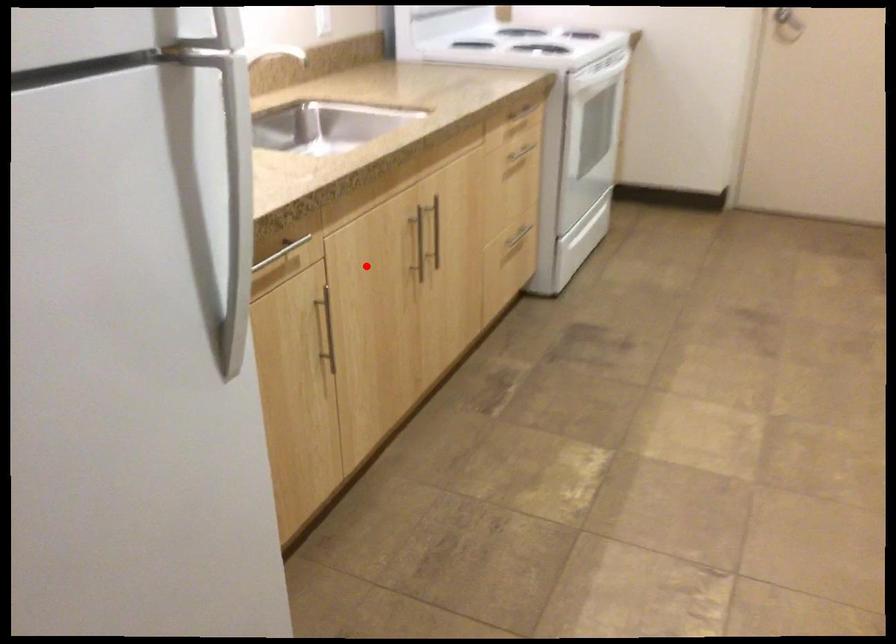
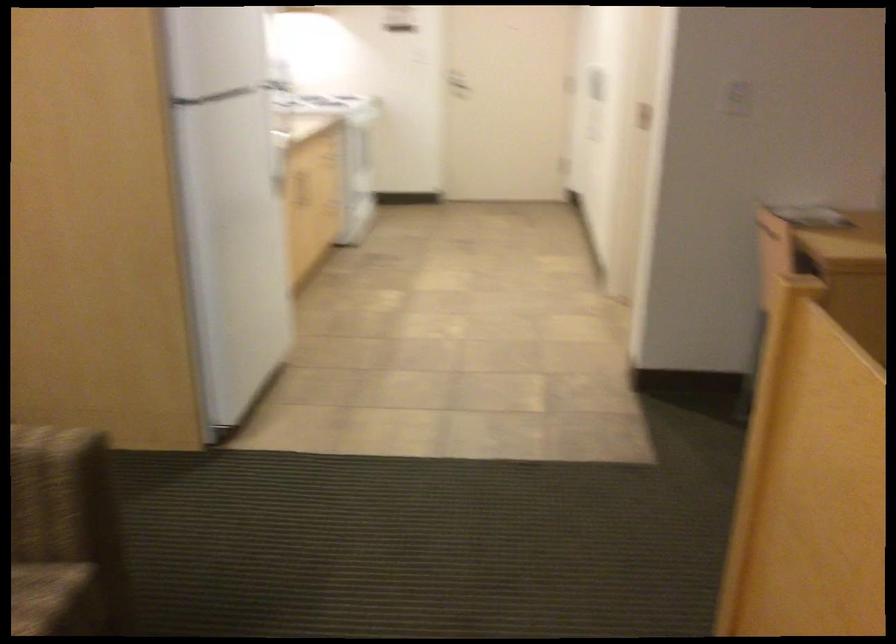
In the second image, find the point that corresponds to the highlighted location in the first image.

(297, 187)